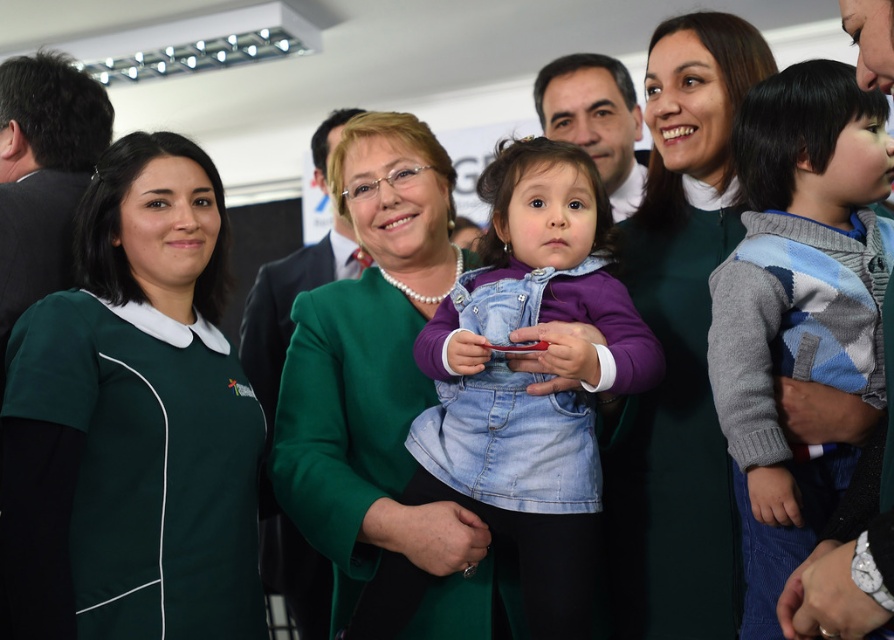
From the picture: You are organizing a charity event and need to place two green items on a shelf. The shelf has limited vertical space. You have the green fabric shirt at left and the green satin jacket at center. Which item should you choose to fit better vertically?

The green fabric shirt at left is not as tall as the green satin jacket at center, so the green fabric shirt at left would fit better vertically on the shelf with limited vertical space.

You are at a formal event and see two green items of clothing. The green fabric shirt at left and the green satin jacket at center. Which one is closer to the bottom of the image?

The green fabric shirt at left is positioned under the green satin jacket at center, so it is closer to the bottom of the image.

You are standing in the room and see two points marked in the image. Which point is closer to you, point (162, 244) or point (348, 307)?

Point (162, 244) is closer to the viewer than point (348, 307).